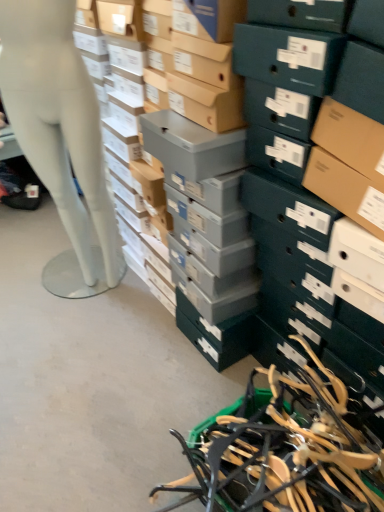
What do you see at coordinates (60, 136) in the screenshot? I see `matte white mannequin at left` at bounding box center [60, 136].

Measure the distance between matte white mannequin at left and camera.

matte white mannequin at left and camera are 4.01 feet apart from each other.

What is the approximate width of matte white mannequin at left?

matte white mannequin at left is 29.61 centimeters in width.

The width and height of the screenshot is (384, 512). Find the location of `matte white mannequin at left`. matte white mannequin at left is located at coordinates click(x=60, y=136).

Where is `matte white mannequin at left`? matte white mannequin at left is located at coordinates (60, 136).